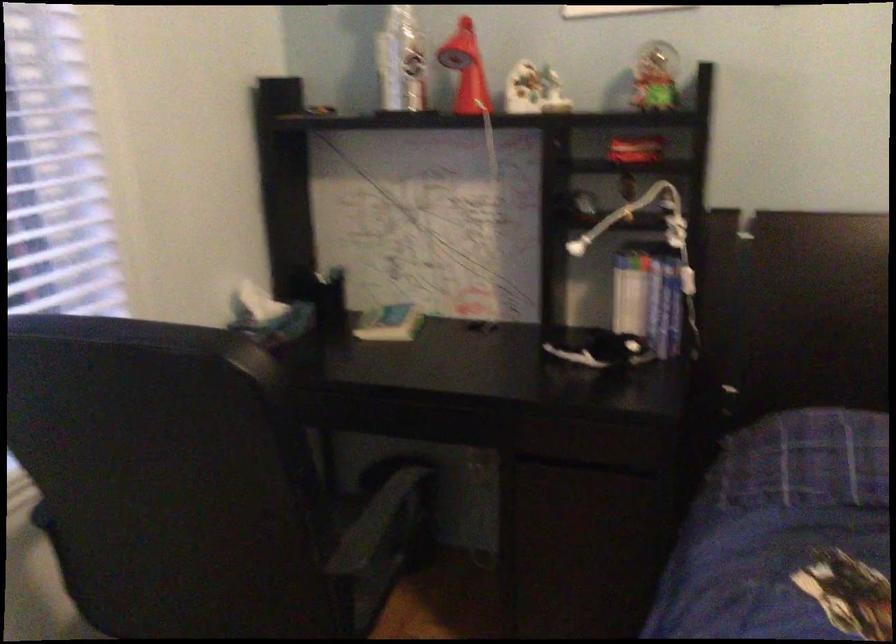
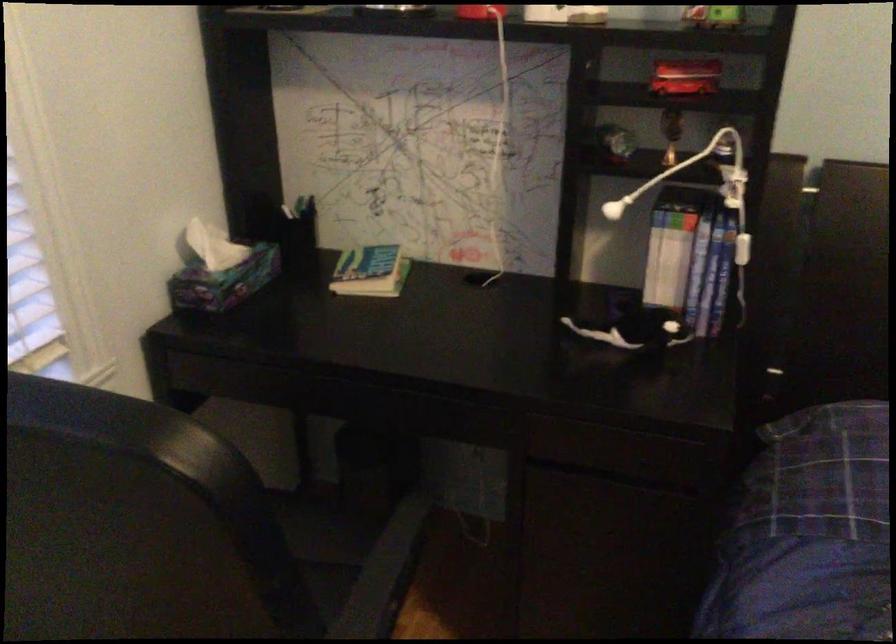
Locate, in the second image, the point that corresponds to (692,279) in the first image.

(742, 249)